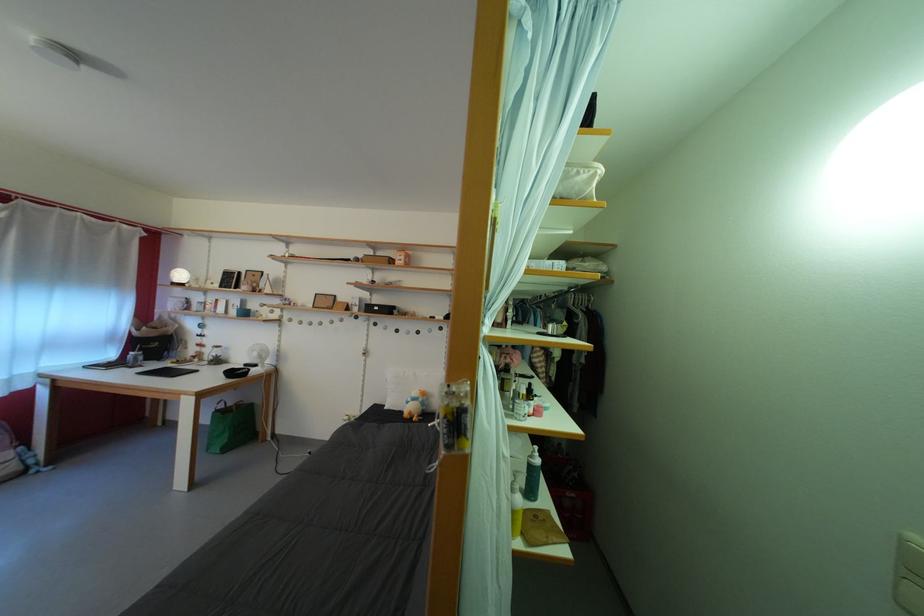
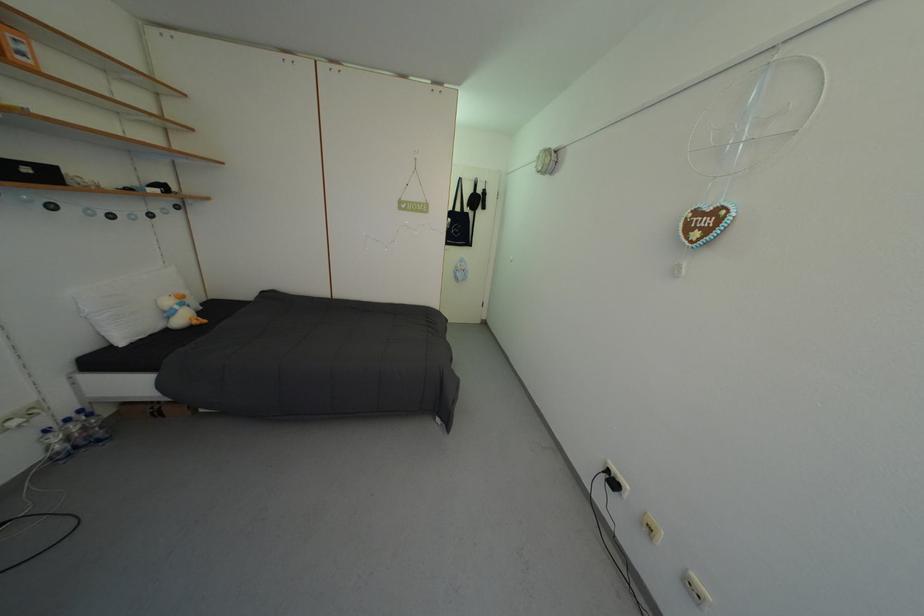
Find the pixel in the second image that matches (418,405) in the first image.

(186, 313)